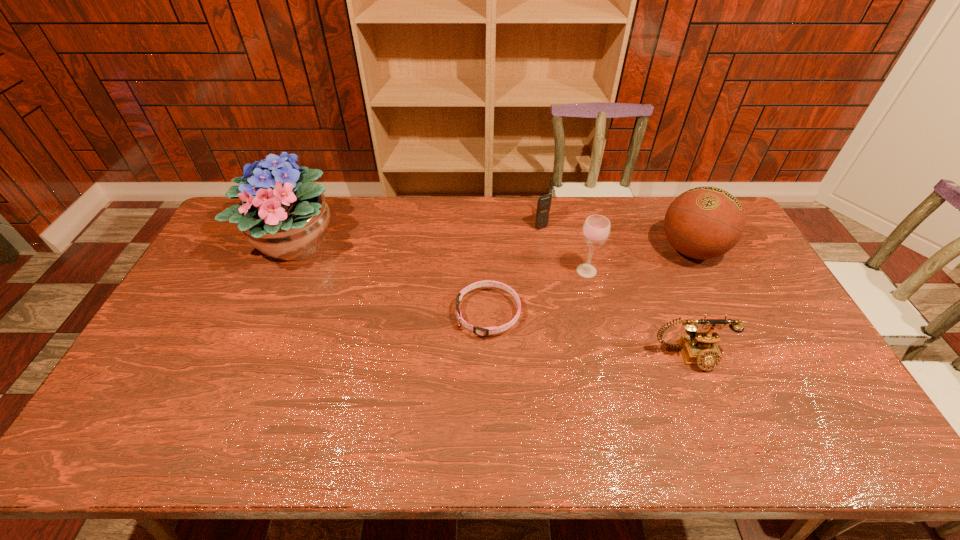
You are a GUI agent. You are given a task and a screenshot of the screen. Output one action in this format:
    pyautogui.click(x=<x>, y=<y>)
    Task: Click on the free space between the tallest object and the dog collar
    This screenshot has width=960, height=540.
    Given the screenshot: What is the action you would take?
    pyautogui.click(x=391, y=279)

Locate an element on the screen. This screenshot has height=540, width=960. free space between the telephone and the cellular telephone is located at coordinates (615, 290).

At what (x,y) coordinates should I click in order to perform the action: click on free space between the shortest object and the cellular telephone. Please return your answer as a coordinate pair (x, y). Looking at the image, I should click on (515, 269).

Find the location of a particular element. Image resolution: width=960 pixels, height=540 pixels. vacant area that lies between the fifth tallest object and the tallest object is located at coordinates (492, 300).

Where is `vacant area that lies between the basketball and the wineglass`? vacant area that lies between the basketball and the wineglass is located at coordinates (638, 260).

Find the location of a particular element. This screenshot has width=960, height=540. vacant area between the second object from left to right and the basketball is located at coordinates (589, 282).

Identify the location of vacant region between the cellular telephone and the fifth object from right to left. Image resolution: width=960 pixels, height=540 pixels. (x=515, y=269).

Image resolution: width=960 pixels, height=540 pixels. What are the coordinates of `vacant area that lies between the second shortest object and the dog collar` in the screenshot? It's located at (589, 335).

At what (x,y) coordinates should I click in order to perform the action: click on free space between the bouquet and the telephone. Please return your answer as a coordinate pair (x, y). Looking at the image, I should click on (492, 300).

Find the location of `the closest object to the third object from right to left`. the closest object to the third object from right to left is located at coordinates (544, 202).